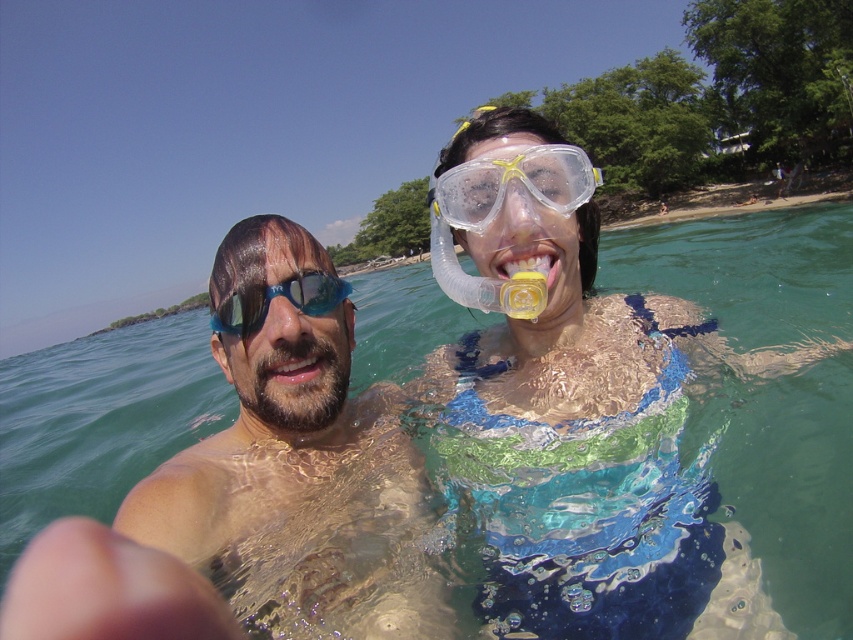
You are a photographer trying to capture a closeup shot of the pink glossy lips at center and the clear blue water at center. Which object is narrower in the image?

The pink glossy lips at center is narrower than the clear blue water at center.

You are a photographer taking a picture of the scene. You notice the pink glossy lips at center and the clear blue water at center. Which object will appear larger in your photo?

The pink glossy lips at center will appear larger in the photo because it is closer to the viewer than the clear blue water at center.

You are designing a new product that needs to fit between the transparent plastic goggles at center and the pink glossy lips at center. What is the minimum width required for your product to fit between them?

The transparent plastic goggles at center has a larger width than the pink glossy lips at center, so the minimum width required for the product should be based on the goggles width to ensure it fits between them.